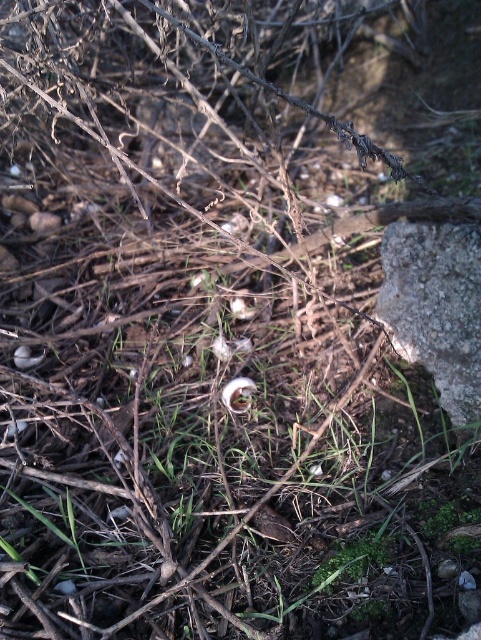
Question: Does gray rough stone at right have a greater width compared to white matte flower at center?

Choices:
 (A) yes
 (B) no

Answer: (A)

Question: Is gray rough stone at right positioned in front of white matte flower at center?

Choices:
 (A) no
 (B) yes

Answer: (B)

Question: Which point is closer to the camera?

Choices:
 (A) white matte flower at center
 (B) gray rough stone at right

Answer: (B)

Question: Can you confirm if gray rough stone at right is wider than white matte flower at center?

Choices:
 (A) yes
 (B) no

Answer: (A)

Question: Which point is closer to the camera?

Choices:
 (A) white matte flower at center
 (B) gray rough stone at right

Answer: (B)